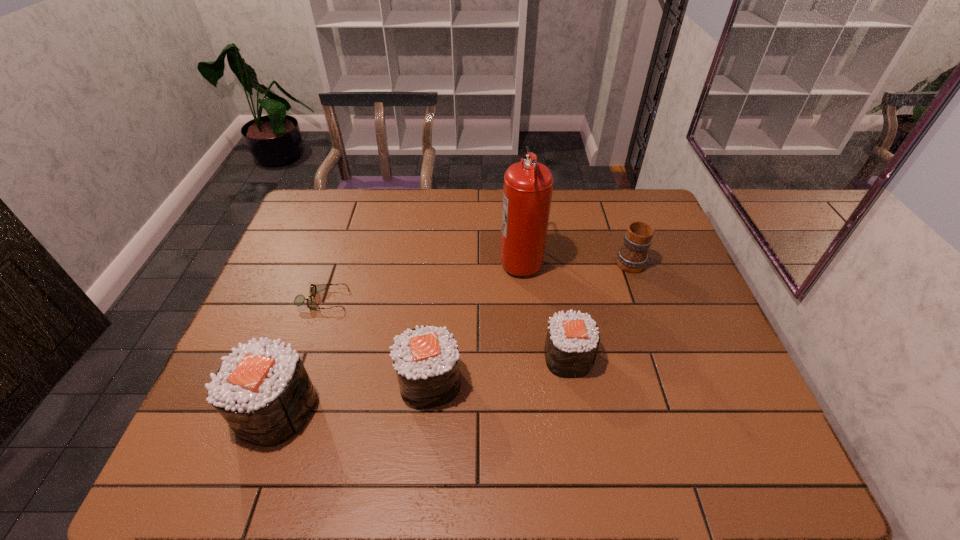
Find the location of a particular element. This screenshot has height=540, width=960. free space between the second sushi from right to left and the rightmost object is located at coordinates (529, 321).

Locate an element on the screen. free spot between the tallest object and the shortest object is located at coordinates (422, 279).

Where is `vacant space that is in between the mug and the fire extinguisher`? The image size is (960, 540). vacant space that is in between the mug and the fire extinguisher is located at coordinates (575, 259).

Locate an element on the screen. The height and width of the screenshot is (540, 960). vacant space in between the shortest sushi and the tallest object is located at coordinates (544, 308).

The image size is (960, 540). What are the coordinates of `empty space between the leftmost sushi and the third object from left to right` in the screenshot? It's located at (353, 396).

Locate an element on the screen. Image resolution: width=960 pixels, height=540 pixels. free area in between the second shortest sushi and the tallest object is located at coordinates (475, 320).

Find the location of a particular element. The image size is (960, 540). vacant space that is in between the tallest object and the leftmost sushi is located at coordinates (398, 334).

You are a GUI agent. You are given a task and a screenshot of the screen. Output one action in this format:
    pyautogui.click(x=<x>, y=<y>)
    Task: Click on the object that stands as the fifth closest to the leftmost sushi
    
    Given the screenshot: What is the action you would take?
    pyautogui.click(x=632, y=257)

Point out which object is positioned as the fourth nearest to the tallest object. Please provide its 2D coordinates. Your answer should be formatted as a tuple, i.e. [(x, y)], where the tuple contains the x and y coordinates of a point satisfying the conditions above.

[(299, 300)]

This screenshot has width=960, height=540. I want to click on the closest sushi to the second tallest sushi, so click(x=263, y=391).